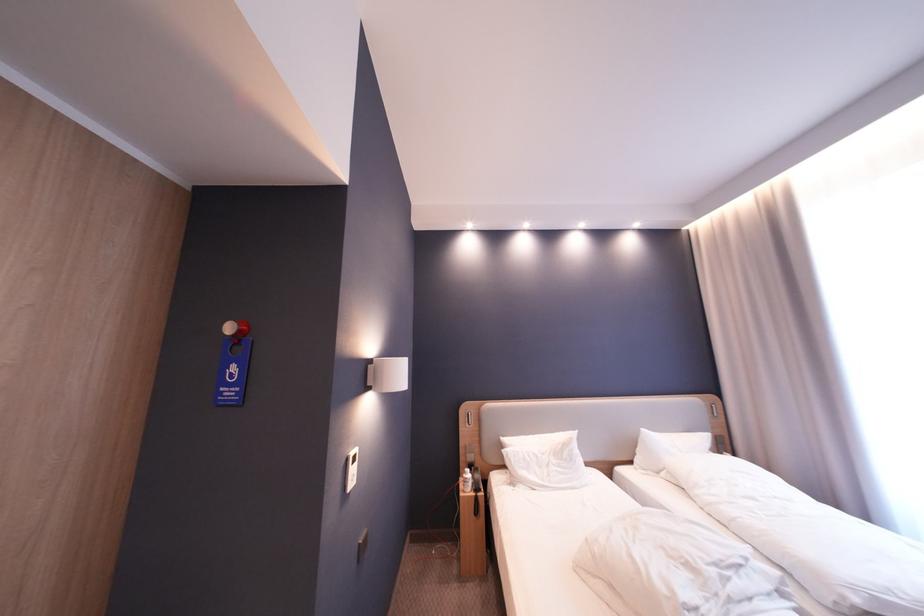
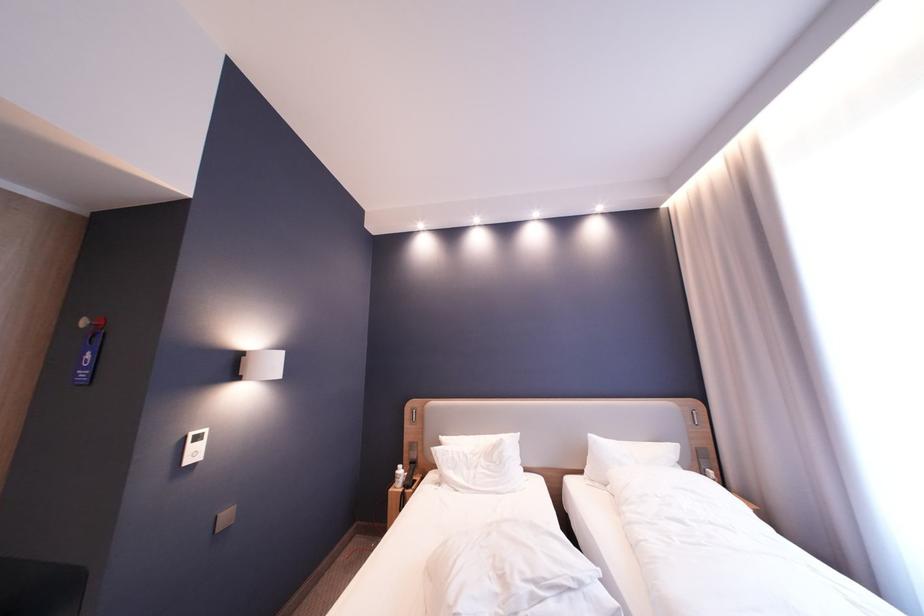
Question: Which direction would the cameraman need to move to produce the second image? Reply with the corresponding letter.

Choices:
 (A) Left
 (B) Right
 (C) Forward
 (D) Backward

Answer: (B)